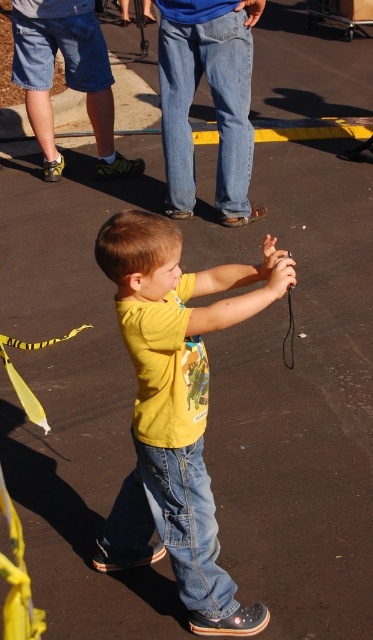
Based on the photo, you are a drone operator trying to capture a close shot of the child in the image. You have two points marked in the scene, point A at coordinates point[217,97] and point B at coordinates point[170,483]. Which point should you choose to get closer to the child?

Point A at coordinates point[217,97] is closer to the child because it is further to the viewer than point B at coordinates point[170,483].